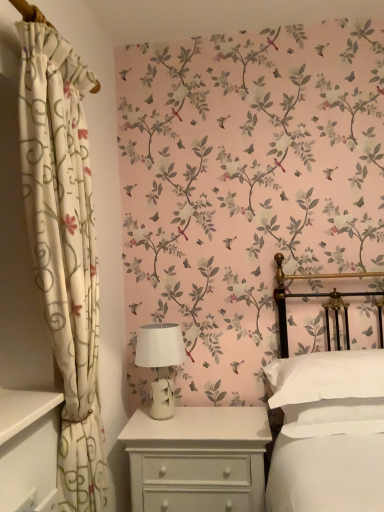
Identify the location of free point to the right of white ceramic table lamp at center. (218, 416).